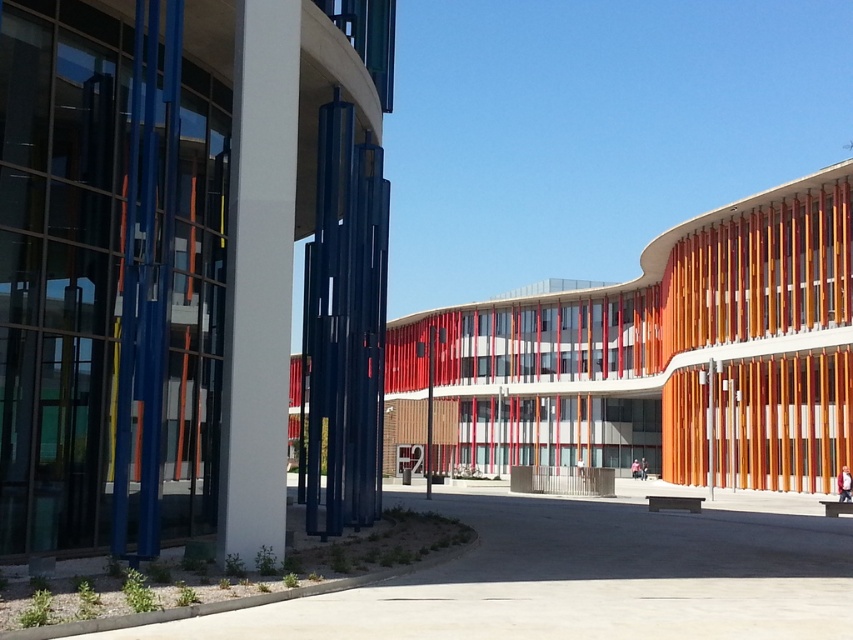
Question: Is orange wood building at center closer to camera compared to white smooth pillar at center?

Choices:
 (A) no
 (B) yes

Answer: (A)

Question: Which of the following is the farthest from the observer?

Choices:
 (A) orange wood building at center
 (B) white smooth pillar at center
 (C) polished glass wind chimes at center

Answer: (A)

Question: Is polished glass wind chimes at center closer to the viewer compared to orange wood building at center?

Choices:
 (A) yes
 (B) no

Answer: (A)

Question: Among these objects, which one is nearest to the camera?

Choices:
 (A) polished glass wind chimes at center
 (B) orange wood building at center

Answer: (A)

Question: Does polished glass wind chimes at center have a smaller size compared to orange wood building at center?

Choices:
 (A) no
 (B) yes

Answer: (B)

Question: Which point is farther to the camera?

Choices:
 (A) polished glass wind chimes at center
 (B) orange wood building at center
 (C) white smooth pillar at center

Answer: (B)